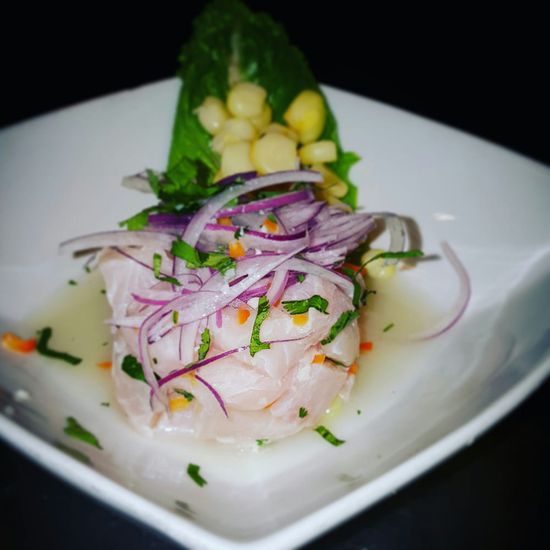
Identify the location of white bowl. (468, 178).